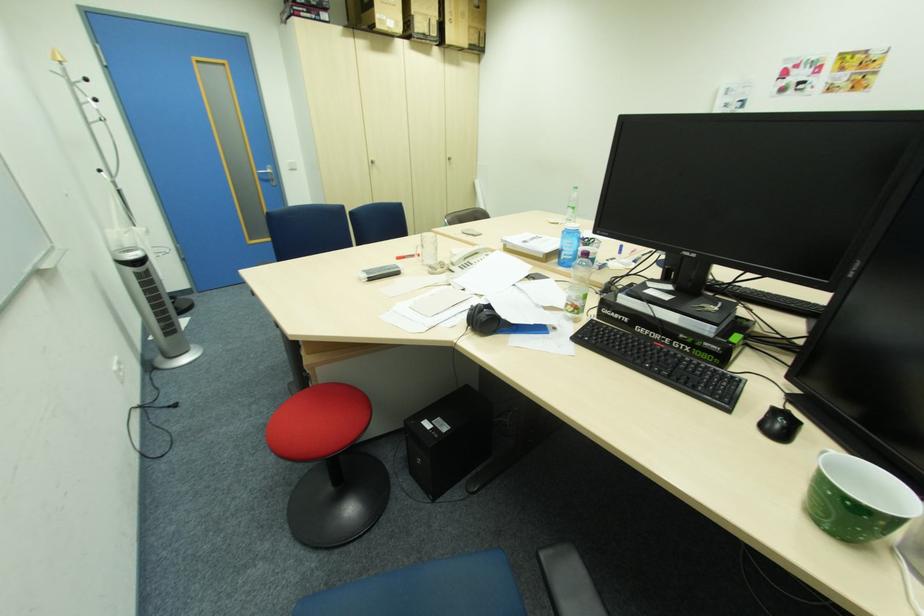
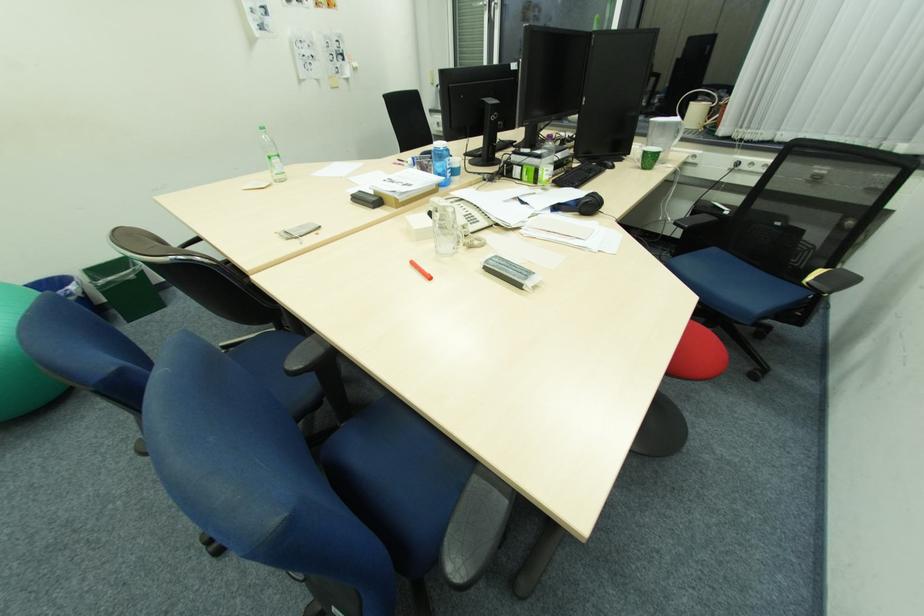
In the second image, find the point that corresponds to the point at 574,209 in the first image.

(280, 161)